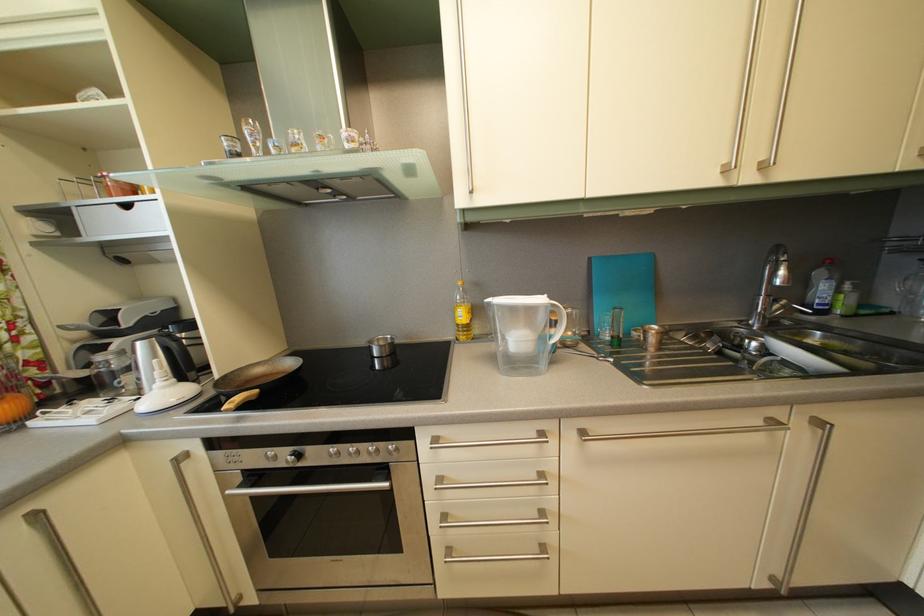
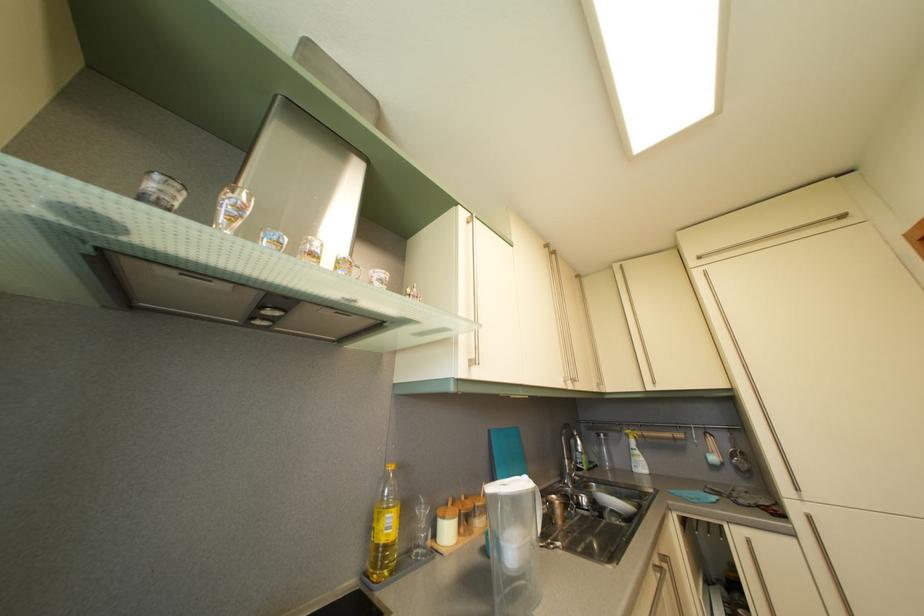
Locate, in the second image, the point that corresponds to [526,347] in the first image.

(521, 554)